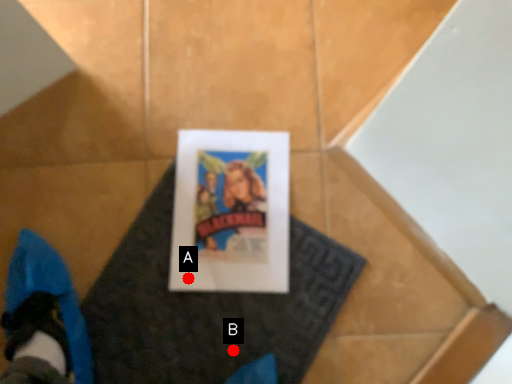
Question: Two points are circled on the image, labeled by A and B beside each circle. Which point is closer to the camera taking this photo?

Choices:
 (A) A is closer
 (B) B is closer

Answer: (B)